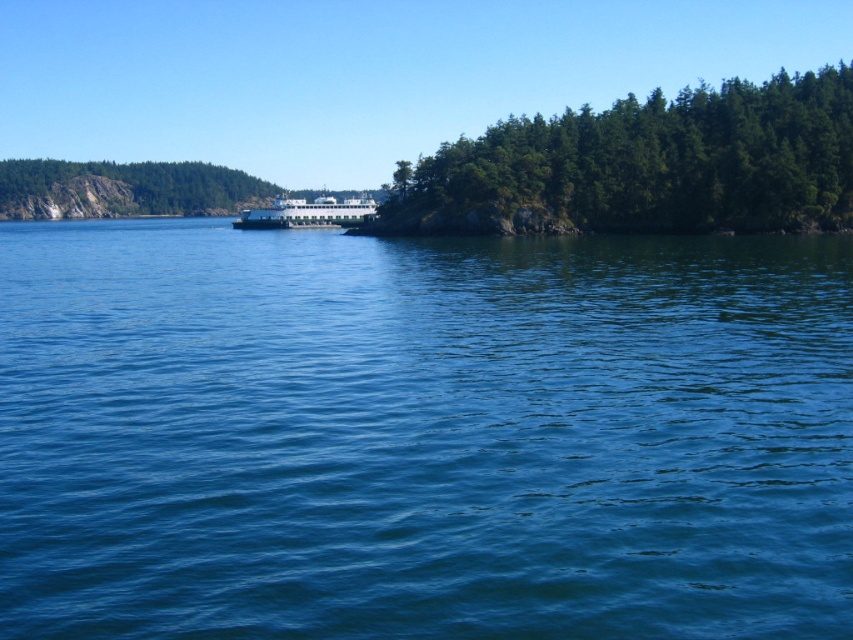
Can you confirm if blue water at center is smaller than green leafy trees at right?

Yes.

Can you confirm if blue water at center is thinner than green leafy trees at right?

Yes, blue water at center is thinner than green leafy trees at right.

Identify the location of blue water at center. The height and width of the screenshot is (640, 853). [421, 435].

Who is shorter, green leafy trees at right or green matte rock at left?

Standing shorter between the two is green matte rock at left.

Who is more distant from viewer, (x=670, y=124) or (x=62, y=180)?

The point (x=62, y=180) is behind.

This screenshot has width=853, height=640. I want to click on green leafy trees at right, so click(x=647, y=164).

Does point (535, 627) come closer to viewer compared to point (344, 214)?

Yes, it is in front of point (344, 214).

Can you confirm if blue water at center is positioned to the left of white glossy ferry at center?

In fact, blue water at center is to the right of white glossy ferry at center.

Does point (299, 420) come closer to viewer compared to point (306, 200)?

That is True.

At what (x,y) coordinates should I click in order to perform the action: click on blue water at center. Please return your answer as a coordinate pair (x, y). This screenshot has height=640, width=853. Looking at the image, I should click on (421, 435).